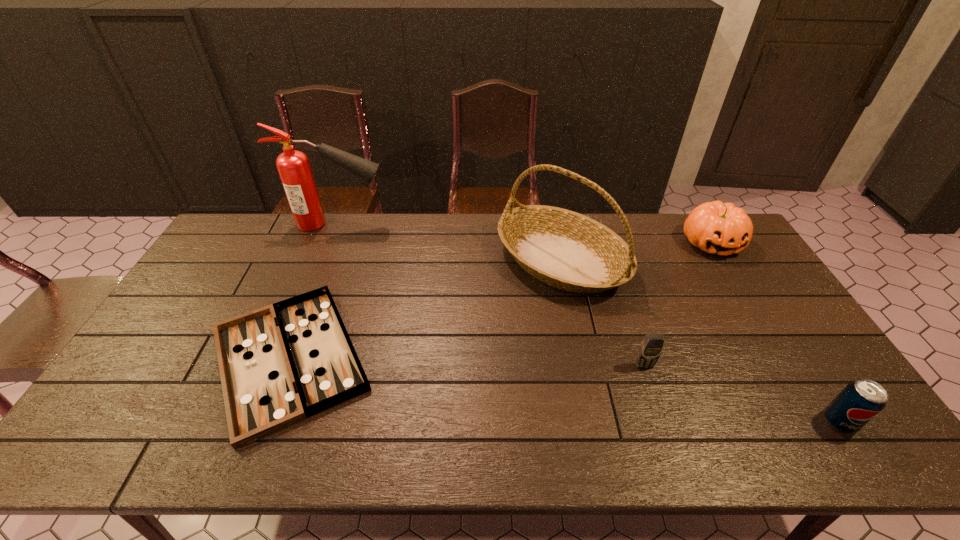
This screenshot has width=960, height=540. Find the location of `free location located on the front face of the cellular telephone`. free location located on the front face of the cellular telephone is located at coordinates (661, 417).

Image resolution: width=960 pixels, height=540 pixels. Identify the location of free space located 0.300m on the right of the shortest object. (489, 358).

This screenshot has width=960, height=540. What are the coordinates of `fire extinguisher at the far edge` in the screenshot? It's located at (293, 166).

At what (x,y) coordinates should I click in order to perform the action: click on basket located at the far edge. Please return your answer as a coordinate pair (x, y). This screenshot has width=960, height=540. Looking at the image, I should click on (x=564, y=249).

Identify the location of pumpkin situated at the far edge. The height and width of the screenshot is (540, 960). (719, 228).

At what (x,y) coordinates should I click in order to perform the action: click on soda can present at the near edge. Please return your answer as a coordinate pair (x, y). Looking at the image, I should click on (861, 400).

You are a GUI agent. You are given a task and a screenshot of the screen. Output one action in this format:
    pyautogui.click(x=<x>, y=<y>)
    Task: Click on the gameboard that is positioned at the near edge
    This screenshot has width=960, height=540.
    Given the screenshot: What is the action you would take?
    pyautogui.click(x=280, y=364)

At what (x,y) coordinates should I click in order to perform the action: click on pumpkin at the right edge. Please return your answer as a coordinate pair (x, y). The width and height of the screenshot is (960, 540). Looking at the image, I should click on (719, 228).

The height and width of the screenshot is (540, 960). In order to click on soda can that is at the right edge in this screenshot , I will do `click(861, 400)`.

Locate an element on the screen. The image size is (960, 540). object that is at the far right corner is located at coordinates (719, 228).